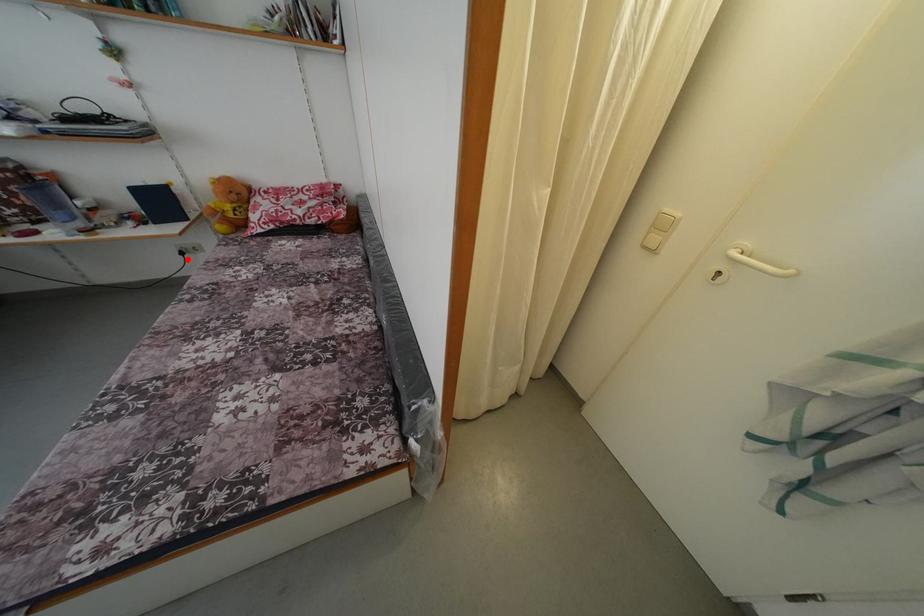
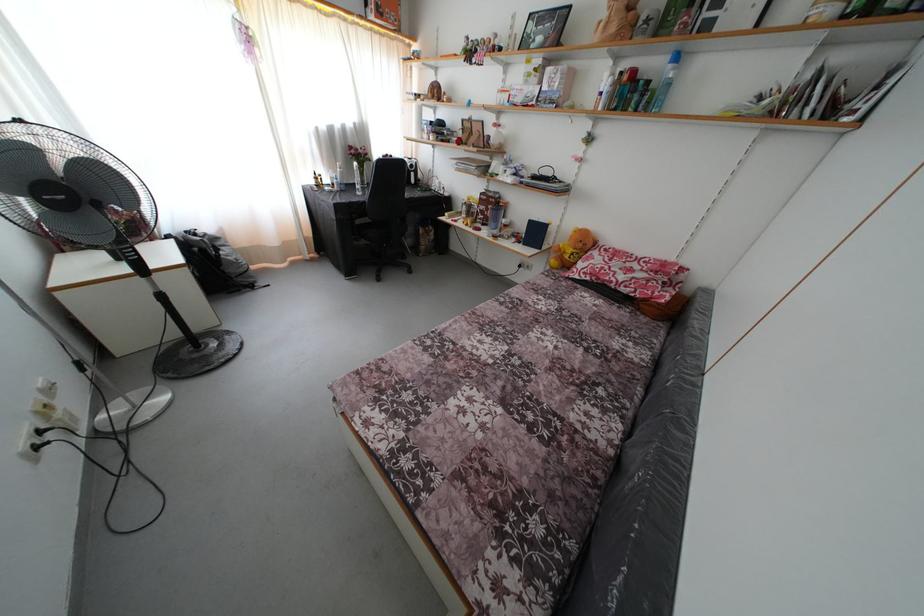
Where in the second image is the point corresponding to the highlighted location from the first image?

(525, 272)